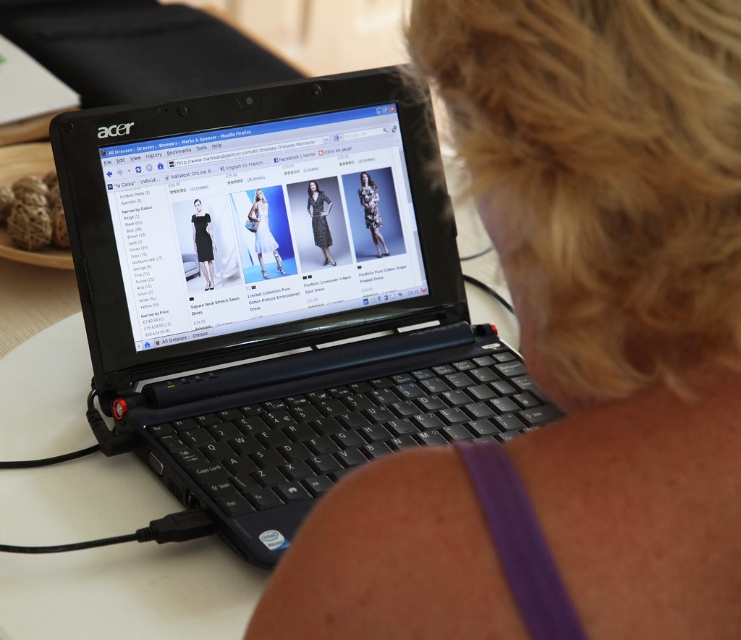
Which of these two, matte black dress at center or black satin dress at center, stands taller?

matte black dress at center

Is matte black dress at center shorter than black satin dress at center?

No.

This screenshot has height=640, width=741. I want to click on matte black dress at center, so click(x=319, y=220).

Locate an element on the screen. Image resolution: width=741 pixels, height=640 pixels. matte black dress at center is located at coordinates (319, 220).

Can you confirm if matte black laptop at center is positioned to the right of matte black dress at center?

No, matte black laptop at center is not to the right of matte black dress at center.

Is matte black laptop at center positioned in front of matte black dress at center?

Yes, it is in front of matte black dress at center.

Identify the location of matte black laptop at center. (268, 224).

Does white satin dress at center have a lesser width compared to floral fabric dress at center?

Incorrect, white satin dress at center's width is not less than floral fabric dress at center's.

Is point (256, 196) positioned behind point (376, 237)?

No, (256, 196) is in front of (376, 237).

This screenshot has width=741, height=640. What do you see at coordinates (262, 230) in the screenshot?
I see `white satin dress at center` at bounding box center [262, 230].

Where is `white satin dress at center`? This screenshot has width=741, height=640. white satin dress at center is located at coordinates (262, 230).